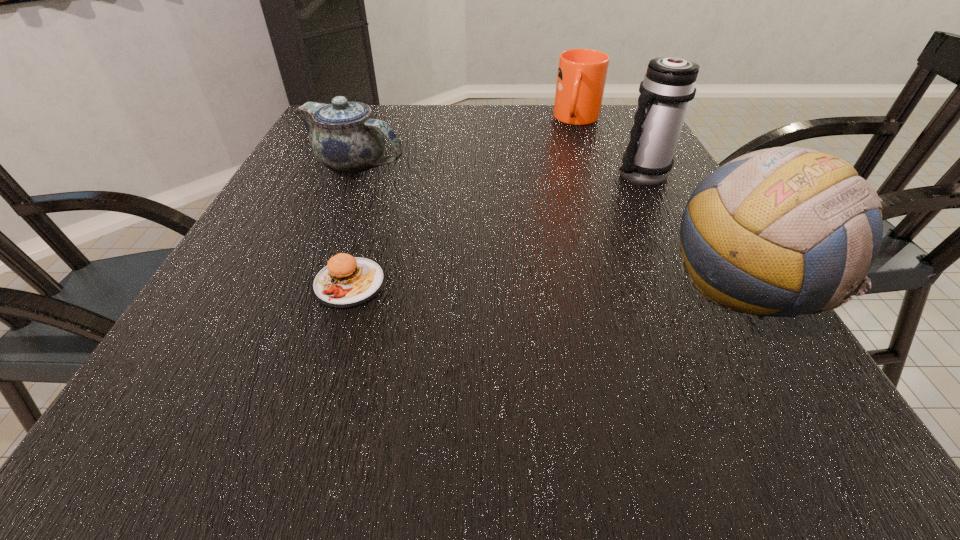
At what (x,y) coordinates should I click in order to perform the action: click on mug situated at the right edge. Please return your answer as a coordinate pair (x, y). Looking at the image, I should click on (581, 77).

What are the coordinates of `thermos bottle present at the right edge` in the screenshot? It's located at (668, 87).

You are a GUI agent. You are given a task and a screenshot of the screen. Output one action in this format:
    pyautogui.click(x=<x>, y=<y>)
    Task: Click on the object located at the far right corner
    The height and width of the screenshot is (540, 960).
    Given the screenshot: What is the action you would take?
    pyautogui.click(x=581, y=77)

This screenshot has width=960, height=540. Identify the location of object present at the near right corner. (791, 224).

Where is `blank space at the far edge of the desktop`? blank space at the far edge of the desktop is located at coordinates (568, 125).

You are a GUI agent. You are given a task and a screenshot of the screen. Output one action in this format:
    pyautogui.click(x=<x>, y=<y>)
    Task: Click on the free region at the near edge
    The width and height of the screenshot is (960, 540).
    Given the screenshot: What is the action you would take?
    pyautogui.click(x=571, y=355)

At what (x,y) coordinates should I click in order to perform the action: click on vacant space at the left edge of the desktop. Please return your answer as a coordinate pair (x, y). Looking at the image, I should click on (279, 230).

In the image, there is a desktop. Where is `free space at the right edge`? free space at the right edge is located at coordinates (659, 235).

Where is `vacant region between the volleyball and the mug`? This screenshot has height=540, width=960. vacant region between the volleyball and the mug is located at coordinates (660, 202).

You are a GUI agent. You are given a task and a screenshot of the screen. Output one action in this format:
    pyautogui.click(x=<x>, y=<y>)
    Task: Click on the unoccupied position between the patty and the mug
    The width and height of the screenshot is (960, 540).
    Given the screenshot: What is the action you would take?
    pyautogui.click(x=464, y=201)